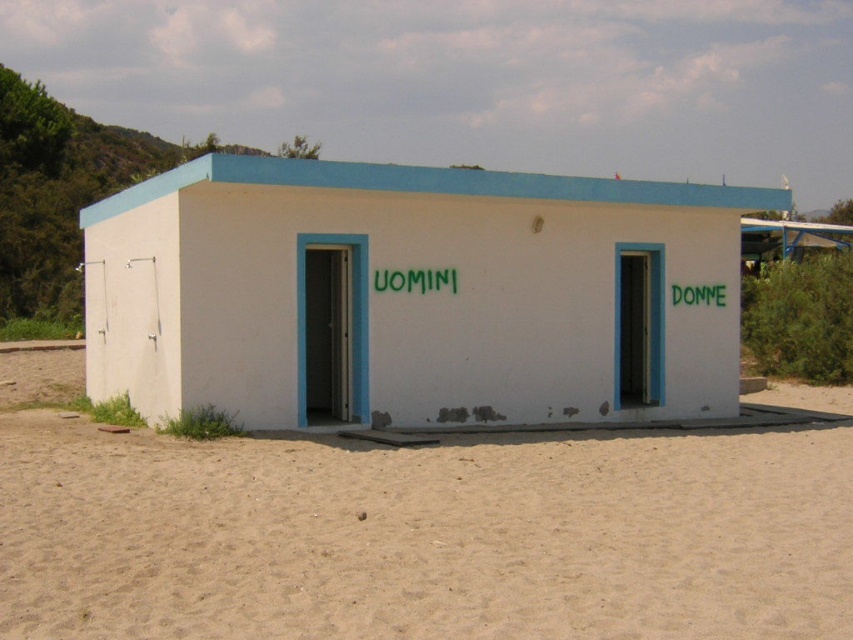
You are standing on the beige sand at lower center and want to enter the white matte building at center. Which direction should you walk to reach the building?

Since the beige sand at lower center is located below the white matte building at center, you should walk upwards or towards the upper part of the scene to reach the building.

From the picture: You are standing on the beige sand at lower center and want to climb onto the white matte building at center. Based on the scene description, is the sand lower than the building? Explain why or why not.

Yes, the beige sand at lower center has a lesser height compared to the white matte building at center, so the sand is lower, making it possible to climb onto the building from the sand.

You are standing at the point labeled point (x=415, y=531) on beige sand at lower center. Which direction should you walk to reach the open door of the public restroom?

The point labeled point (x=415, y=531) is on beige sand at lower center. Since the open door is part of the public restroom structure, which is situated on the sandy beach, you should walk towards the restroom building to reach the open door.